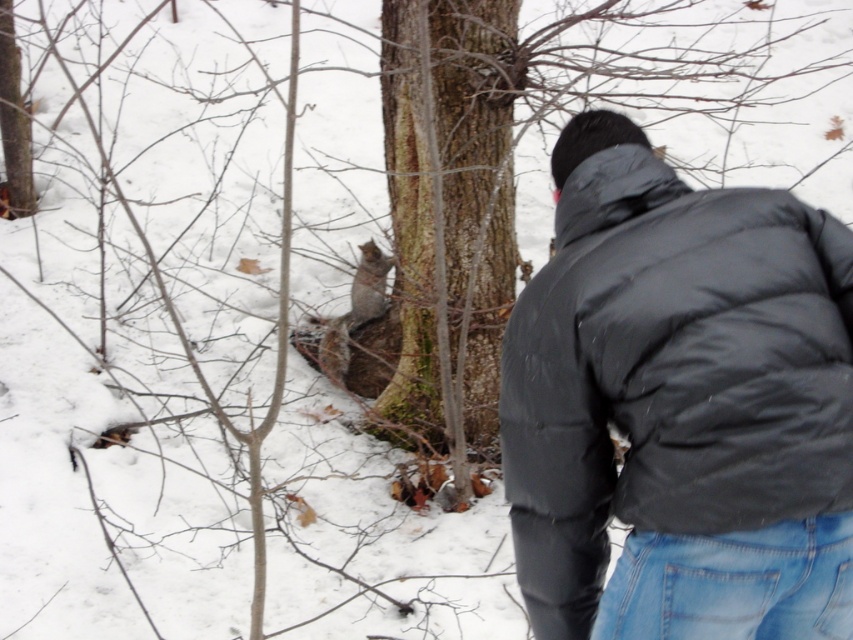
Question: Is black puffy jacket at upper right wider than gray fur squirrel at center?

Choices:
 (A) yes
 (B) no

Answer: (A)

Question: Which point is farther to the camera?

Choices:
 (A) (693, 241)
 (B) (352, 314)

Answer: (B)

Question: Which object is closer to the camera taking this photo?

Choices:
 (A) black puffy jacket at upper right
 (B) gray fur squirrel at center

Answer: (A)

Question: Which point is closer to the camera?

Choices:
 (A) gray fur squirrel at center
 (B) black puffy jacket at upper right

Answer: (B)

Question: Does black puffy jacket at upper right have a greater width compared to gray fur squirrel at center?

Choices:
 (A) no
 (B) yes

Answer: (B)

Question: Does black puffy jacket at upper right have a lesser width compared to gray fur squirrel at center?

Choices:
 (A) no
 (B) yes

Answer: (A)